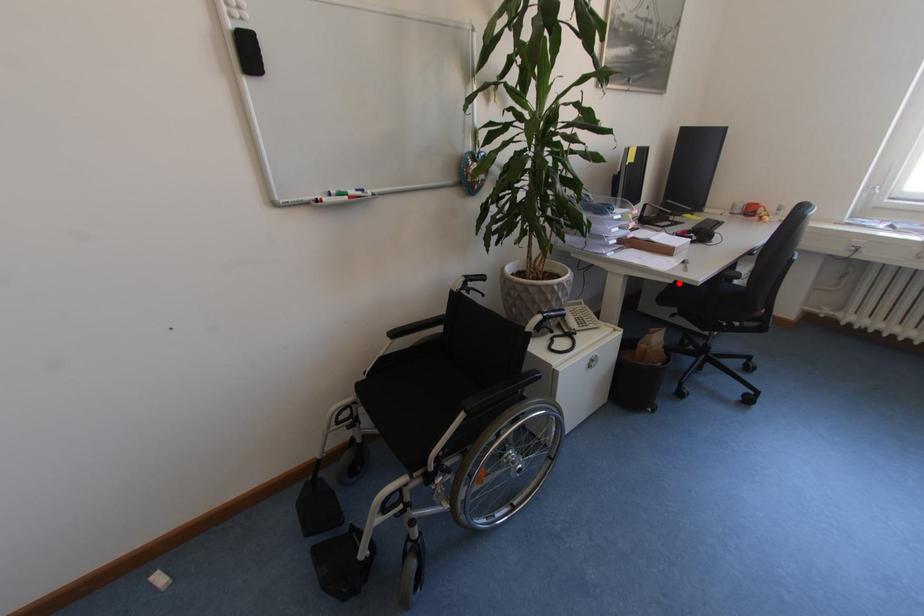
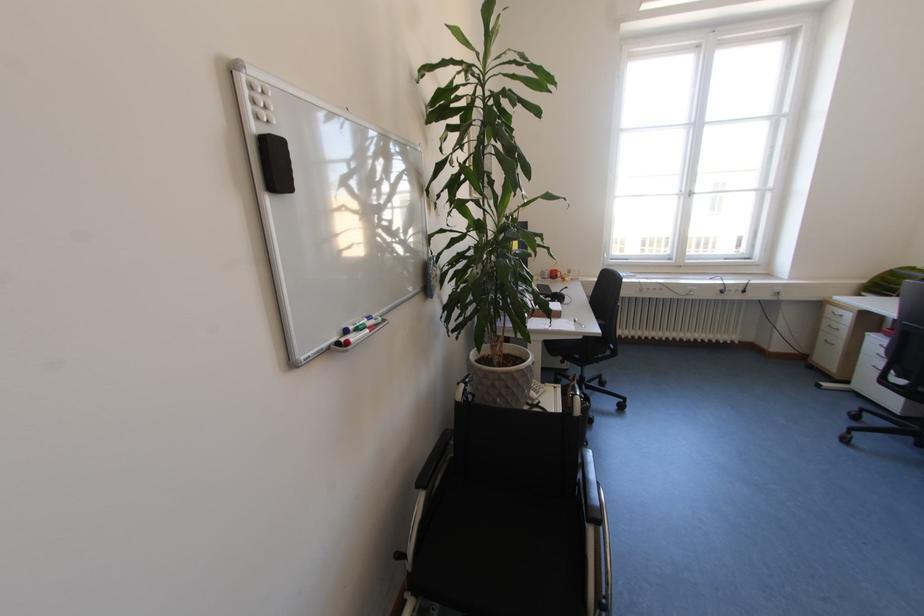
In the second image, find the point that corresponds to the highlighted location in the first image.

(589, 339)